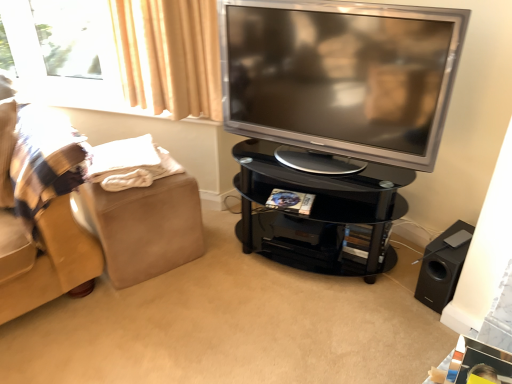
I want to click on free point below silver metallic television at upper right (from a real-world perspective), so click(x=320, y=159).